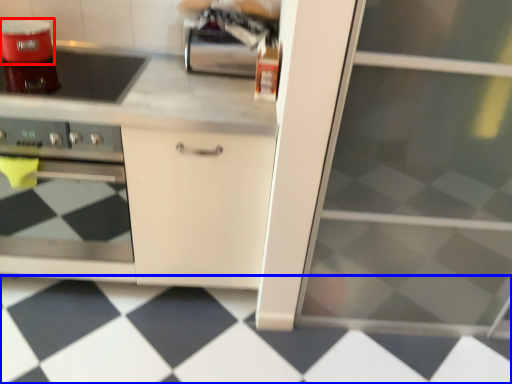
Question: Which object is closer to the camera taking this photo, kitchen appliance (highlighted by a red box) or tile (highlighted by a blue box)?

Choices:
 (A) kitchen appliance
 (B) tile

Answer: (B)